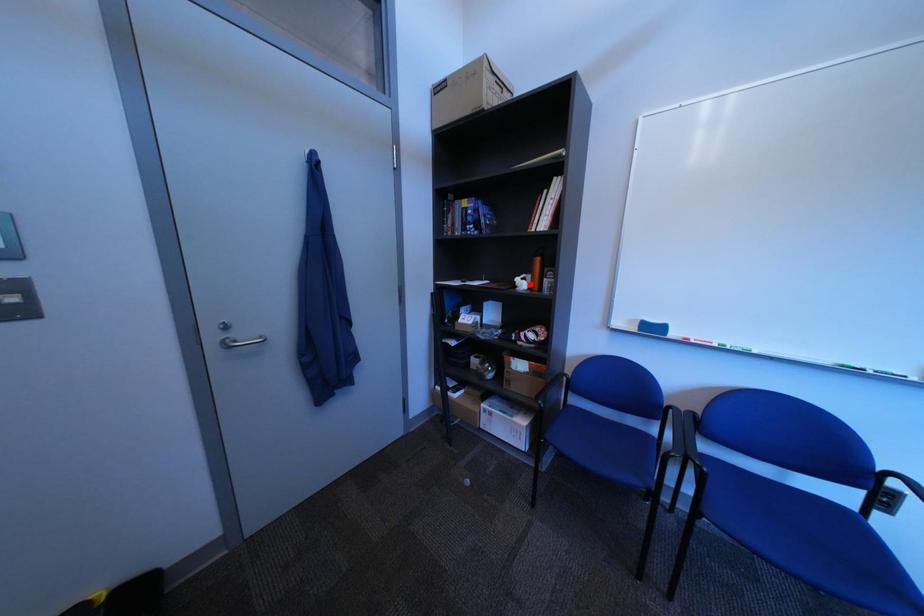
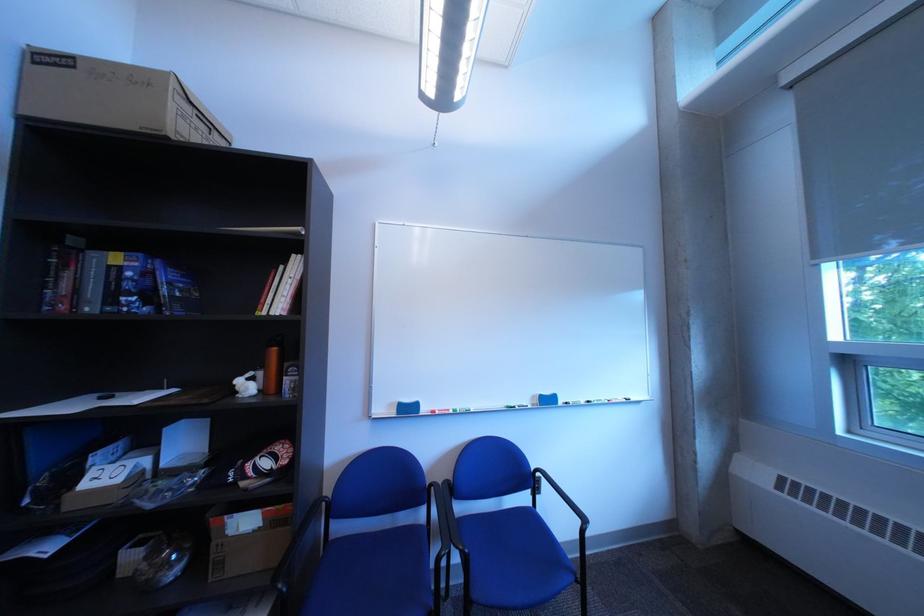
Locate, in the second image, the point that corresponds to the highlighted location in the first image.

(249, 387)